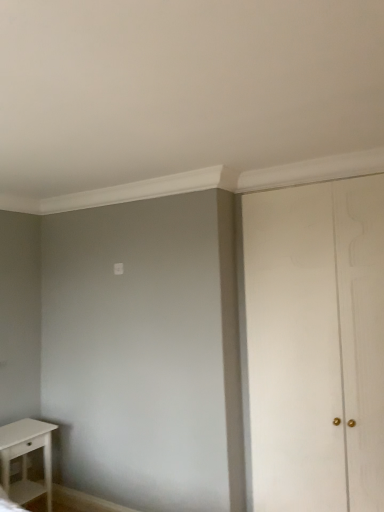
Where is `white wood door at right`? The height and width of the screenshot is (512, 384). white wood door at right is located at coordinates tap(316, 345).

What do you see at coordinates (316, 345) in the screenshot? I see `white wood door at right` at bounding box center [316, 345].

The height and width of the screenshot is (512, 384). What do you see at coordinates (26, 458) in the screenshot?
I see `white matte table at lower left` at bounding box center [26, 458].

Locate an element on the screen. This screenshot has height=512, width=384. white matte table at lower left is located at coordinates (26, 458).

You are a GUI agent. You are given a task and a screenshot of the screen. Output one action in this format:
    pyautogui.click(x=<x>, y=<y>)
    Task: Click on the white wood door at right
    The width and height of the screenshot is (384, 512).
    Given the screenshot: What is the action you would take?
    pyautogui.click(x=316, y=345)

Which object is positioned more to the right, white matte table at lower left or white wood door at right?

Positioned to the right is white wood door at right.

Is the depth of white matte table at lower left less than that of white wood door at right?

No, white matte table at lower left is further to the viewer.

Considering the positions of point (19, 492) and point (253, 236), is point (19, 492) closer or farther from the camera than point (253, 236)?

Point (19, 492) is farther from the camera than point (253, 236).

From the image's perspective, is white matte table at lower left over white wood door at right?

No, from the image's perspective, white matte table at lower left is not on top of white wood door at right.

In the scene shown: From a real-world perspective, who is located higher, white matte table at lower left or white wood door at right?

white wood door at right is physically above.

Which object is thinner, white matte table at lower left or white wood door at right?

white wood door at right is thinner.

Is white matte table at lower left shorter than white wood door at right?

Correct, white matte table at lower left is not as tall as white wood door at right.

In the scene shown: Does white matte table at lower left have a larger size compared to white wood door at right?

Actually, white matte table at lower left might be smaller than white wood door at right.

Is white matte table at lower left not inside white wood door at right?

white matte table at lower left is positioned outside white wood door at right.

Is white matte table at lower left with white wood door at right?

There is a gap between white matte table at lower left and white wood door at right.

Is white matte table at lower left facing away from white wood door at right?

No, white matte table at lower left's orientation is not away from white wood door at right.

Can you tell me how much white matte table at lower left and white wood door at right differ in facing direction?

90.7 degrees.

You are a GUI agent. You are given a task and a screenshot of the screen. Output one action in this format:
    pyautogui.click(x=<x>, y=<y>)
    Task: Click on the table lying on the left of white wood door at right
    The height and width of the screenshot is (512, 384).
    Given the screenshot: What is the action you would take?
    pyautogui.click(x=26, y=458)

Which object is positioned more to the left, white wood door at right or white matte table at lower left?

white matte table at lower left is more to the left.

Does white wood door at right come in front of white matte table at lower left?

Yes, white wood door at right is closer to the camera.

Considering the positions of points (292, 353) and (50, 472), is point (292, 353) farther from camera compared to point (50, 472)?

No.

From the image's perspective, which one is positioned lower, white wood door at right or white matte table at lower left?

white matte table at lower left.

From a real-world perspective, is white wood door at right over white matte table at lower left?

Yes, from a real-world perspective, white wood door at right is over white matte table at lower left

Can you confirm if white wood door at right is thinner than white matte table at lower left?

Yes.

Which of these two, white wood door at right or white matte table at lower left, stands taller?

Standing taller between the two is white wood door at right.

Considering the sizes of objects white wood door at right and white matte table at lower left in the image provided, who is bigger, white wood door at right or white matte table at lower left?

With larger size is white wood door at right.

Would you say white wood door at right is outside white matte table at lower left?

Indeed, white wood door at right is completely outside white matte table at lower left.

Would you say white wood door at right is a long distance from white matte table at lower left?

Absolutely, white wood door at right is distant from white matte table at lower left.

Looking at this image, could you tell me if white wood door at right is facing white matte table at lower left?

No, white wood door at right is not turned towards white matte table at lower left.

The width and height of the screenshot is (384, 512). I want to click on door above the white matte table at lower left (from a real-world perspective), so click(316, 345).

What are the coordinates of `door above the white matte table at lower left (from a real-world perspective)` in the screenshot? It's located at (316, 345).

Identify the location of door in front of the white matte table at lower left. This screenshot has width=384, height=512. (316, 345).